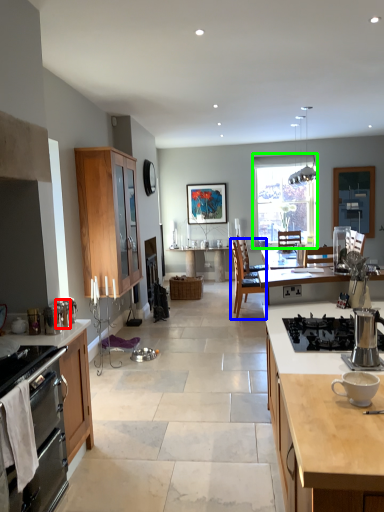
Question: Which object is positioned farthest from appliance (highlighted by a red box)? Select from chair (highlighted by a blue box) and window (highlighted by a green box).

Choices:
 (A) chair
 (B) window

Answer: (B)